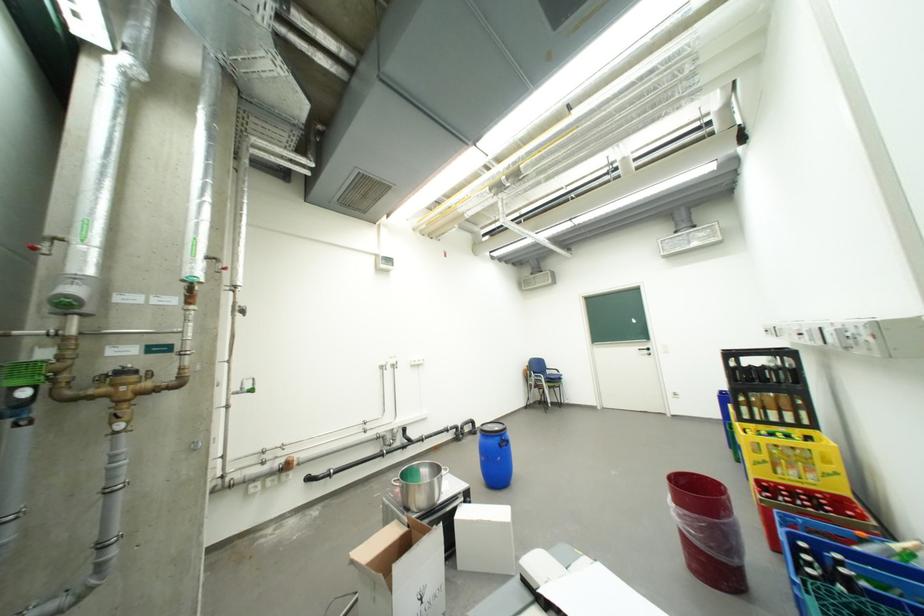
Where would you pull the silver door handle? Please return your answer as a coordinate pair (x, y).

(643, 350)